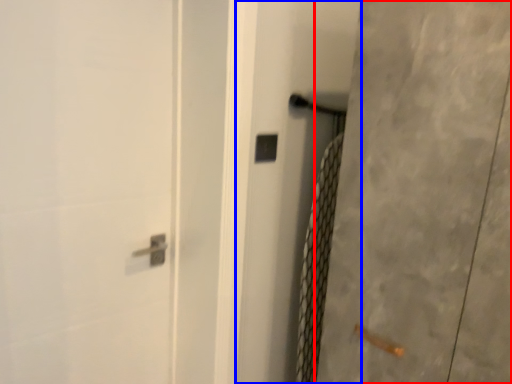
Question: Which of the following is the closest to the observer, screen door (highlighted by a red box) or screen door (highlighted by a blue box)?

Choices:
 (A) screen door
 (B) screen door

Answer: (A)